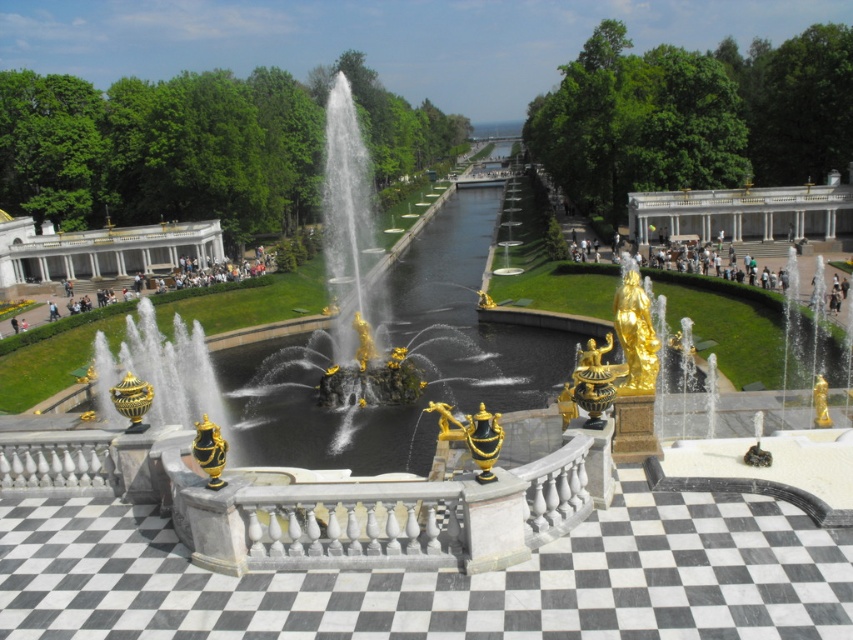
Question: Does white marble palace at upper right come in front of white marble palace at left?

Choices:
 (A) no
 (B) yes

Answer: (B)

Question: From the image, what is the correct spatial relationship of gold polished vase at center in relation to gold polished statue at center-right?

Choices:
 (A) below
 (B) above

Answer: (A)

Question: Is white marble palace at left to the left of gold polished statue at center-right from the viewer's perspective?

Choices:
 (A) yes
 (B) no

Answer: (A)

Question: Which object is farther from the camera taking this photo?

Choices:
 (A) white marble palace at left
 (B) white marble palace at upper right
 (C) black polished water at center

Answer: (A)

Question: Which object appears farthest from the camera in this image?

Choices:
 (A) gold polished statue at center-right
 (B) gold polished vase at center

Answer: (A)

Question: Which point appears closest to the camera in this image?

Choices:
 (A) (117, 250)
 (B) (206, 456)

Answer: (B)